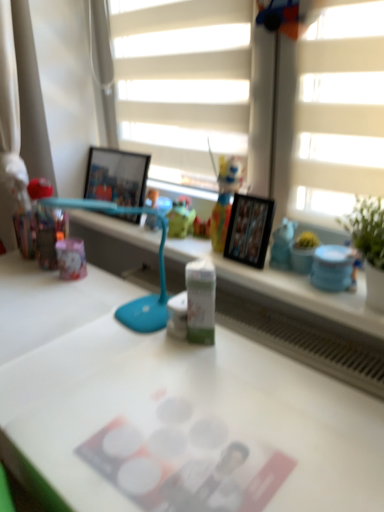
Where is `vacant area located to the right-hand side of green matte milk carton at center, placed as the 2th stationery when sorted from right to left`? Image resolution: width=384 pixels, height=512 pixels. vacant area located to the right-hand side of green matte milk carton at center, placed as the 2th stationery when sorted from right to left is located at coordinates (261, 353).